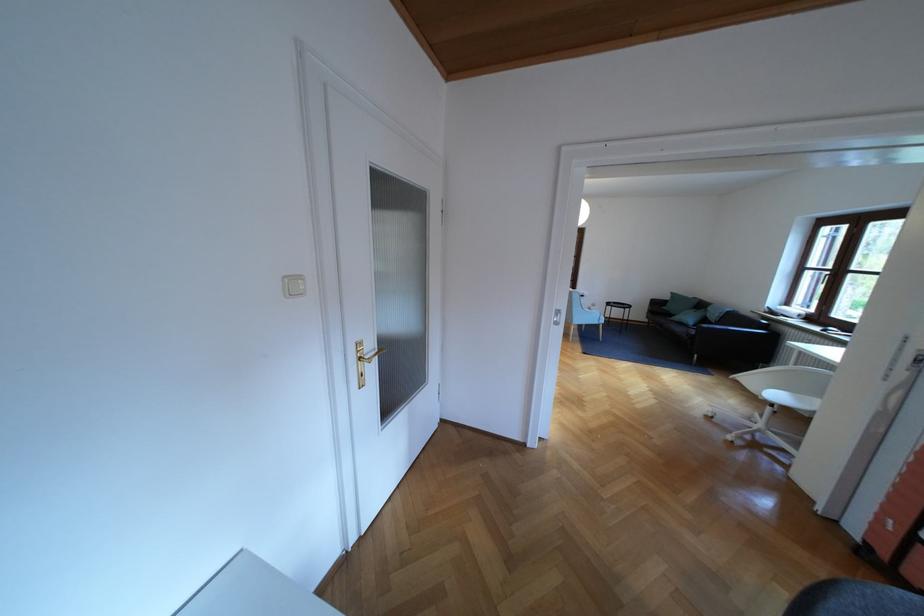
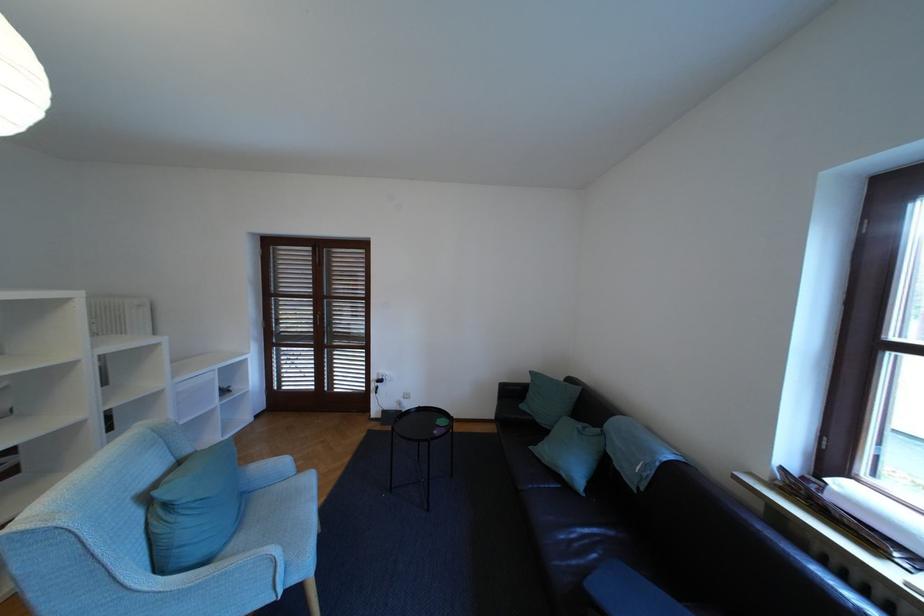
Where in the second image is the point corresponding to (x=686, y=318) from the first image?

(554, 452)